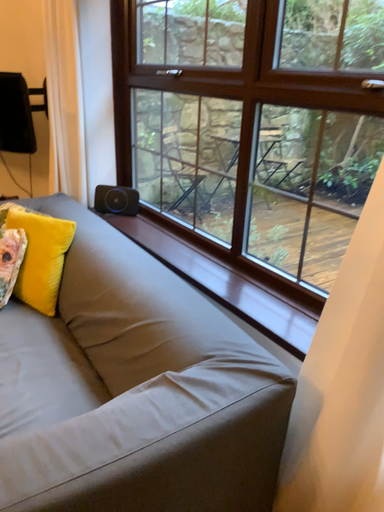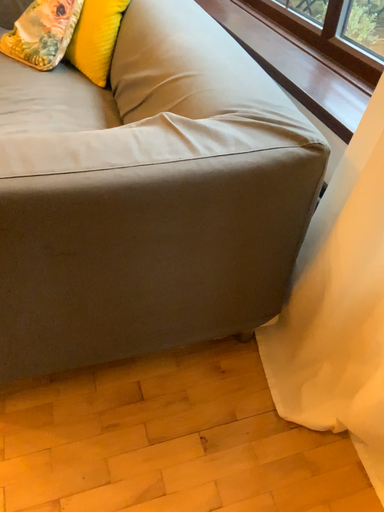
Question: Which way did the camera rotate in the video?

Choices:
 (A) rotated downward
 (B) rotated upward

Answer: (A)